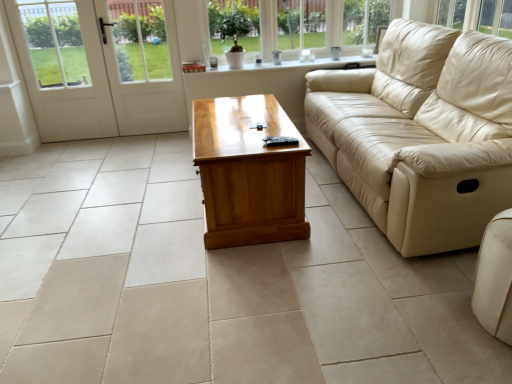
Question: Is white glossy door at left to the left or to the right of beige leather couch at right, the second studio couch when ordered from front to back, in the image?

Choices:
 (A) right
 (B) left

Answer: (B)

Question: From a real-world perspective, relative to beige leather couch at right, the 1th studio couch positioned from the top, is white glossy door at left vertically above or below?

Choices:
 (A) below
 (B) above

Answer: (B)

Question: Based on their relative distances, which object is nearer to the white glossy door at left?

Choices:
 (A) beige leather couch at lower right, the 2th studio couch viewed from the back
 (B) beige leather couch at right, the second studio couch when ordered from front to back
 (C) white wooden screen door at left
 (D) clear glass window at upper center
 (E) light brown wood coffee table at center

Answer: (C)

Question: Estimate the real-world distances between objects in this image. Which object is closer to the light brown wood coffee table at center?

Choices:
 (A) beige leather couch at lower right, which appears as the first studio couch when viewed from the front
 (B) white wooden screen door at left
 (C) clear glass window at upper center
 (D) white glossy door at left
 (E) beige leather couch at right, marked as the first studio couch in a back-to-front arrangement

Answer: (E)